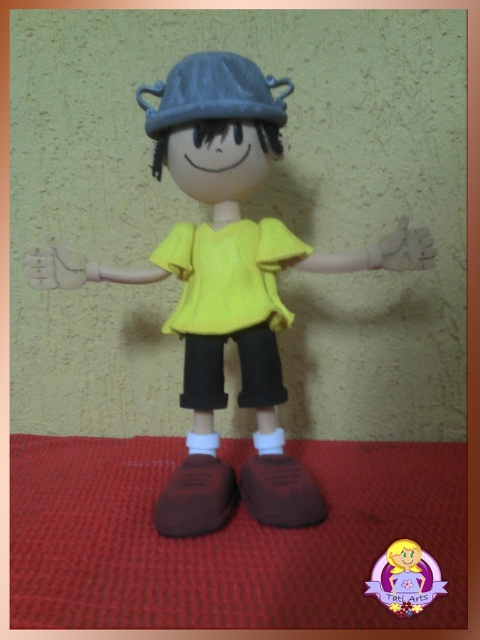
This screenshot has height=640, width=480. Describe the element at coordinates (227, 289) in the screenshot. I see `matte yellow fabric shirt at center` at that location.

Does point (170, 234) come behind point (310, 272)?

Yes, it is behind point (310, 272).

The width and height of the screenshot is (480, 640). What do you see at coordinates (227, 289) in the screenshot?
I see `matte yellow fabric shirt at center` at bounding box center [227, 289].

Image resolution: width=480 pixels, height=640 pixels. Find the location of `matte yellow fabric shirt at center`. matte yellow fabric shirt at center is located at coordinates (227, 289).

Which is in front, point (68, 276) or point (385, 554)?

Point (385, 554) is more forward.

Who is lower down, matte plastic hand at left or matte yellow shirt at center?

matte yellow shirt at center

Where is `matte plastic hand at left`? matte plastic hand at left is located at coordinates coord(84,269).

Where is `matte plastic hand at left`? This screenshot has width=480, height=640. matte plastic hand at left is located at coordinates (84, 269).

Which of these two, matte gray baseball hat at upper center or brown matte hand at center, stands taller?

With more height is matte gray baseball hat at upper center.

Between point (231, 97) and point (427, 268), which one is positioned in front?

Positioned in front is point (231, 97).

Between point (145, 86) and point (408, 266), which one is positioned behind?

Point (145, 86)

Locate an element on the screen. matte gray baseball hat at upper center is located at coordinates pyautogui.click(x=214, y=93).